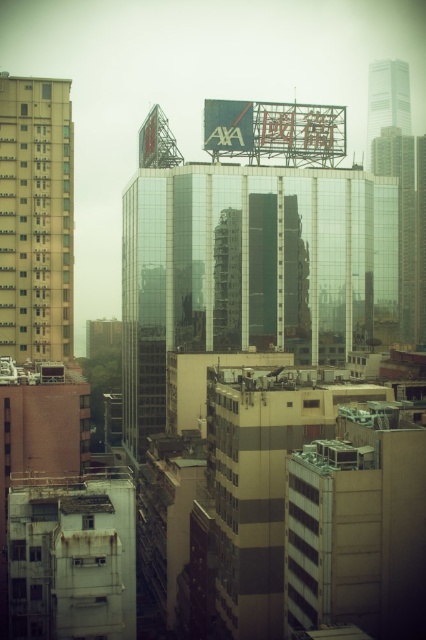
Question: From the image, what is the correct spatial relationship of beige concrete building at left in relation to transparent glass skyscraper at center?

Choices:
 (A) below
 (B) above

Answer: (A)

Question: Which object appears closest to the camera in this image?

Choices:
 (A) transparent glass skyscraper at center
 (B) glass skyscraper at upper right

Answer: (A)

Question: Is beige concrete building at left smaller than glass skyscraper at upper right?

Choices:
 (A) no
 (B) yes

Answer: (B)

Question: Which point is closer to the camera taking this photo?

Choices:
 (A) (45, 157)
 (B) (368, 148)
 (C) (409, 321)

Answer: (A)

Question: Is beige concrete building at left above glass skyscraper at upper right?

Choices:
 (A) yes
 (B) no

Answer: (B)

Question: Which object appears farthest from the camera in this image?

Choices:
 (A) transparent glass skyscraper at center
 (B) beige concrete building at left

Answer: (A)